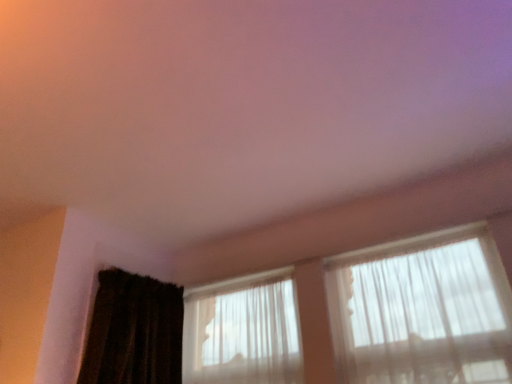
Question: From a real-world perspective, is translucent fabric at upper right, which ranks as the second window in left-to-right order, over translucent fabric window at center, the second window positioned from the right?

Choices:
 (A) yes
 (B) no

Answer: (B)

Question: Is translucent fabric at upper right, positioned as the 1th window in right-to-left order, not close to translucent fabric window at center, the second window positioned from the right?

Choices:
 (A) yes
 (B) no

Answer: (B)

Question: Considering the relative sizes of translucent fabric at upper right, which ranks as the second window in left-to-right order, and translucent fabric window at center, which is the first window from left to right, in the image provided, is translucent fabric at upper right, which ranks as the second window in left-to-right order, smaller than translucent fabric window at center, which is the first window from left to right,?

Choices:
 (A) no
 (B) yes

Answer: (A)

Question: Is translucent fabric at upper right, positioned as the 1th window in right-to-left order, surrounding translucent fabric window at center, which is the first window from left to right?

Choices:
 (A) no
 (B) yes

Answer: (A)

Question: Is translucent fabric at upper right, which ranks as the second window in left-to-right order, next to translucent fabric window at center, which is the first window from left to right?

Choices:
 (A) no
 (B) yes

Answer: (A)

Question: Is translucent fabric at upper right, positioned as the 1th window in right-to-left order, looking in the opposite direction of translucent fabric window at center, which is the first window from left to right?

Choices:
 (A) no
 (B) yes

Answer: (A)

Question: Is translucent fabric at upper right, positioned as the 1th window in right-to-left order, outside of dark brown textured curtain at lower left?

Choices:
 (A) no
 (B) yes

Answer: (B)

Question: From a real-world perspective, is translucent fabric at upper right, which ranks as the second window in left-to-right order, over dark brown textured curtain at lower left?

Choices:
 (A) no
 (B) yes

Answer: (A)

Question: From a real-world perspective, is translucent fabric at upper right, which ranks as the second window in left-to-right order, below dark brown textured curtain at lower left?

Choices:
 (A) no
 (B) yes

Answer: (B)

Question: Considering the relative sizes of translucent fabric at upper right, positioned as the 1th window in right-to-left order, and dark brown textured curtain at lower left in the image provided, is translucent fabric at upper right, positioned as the 1th window in right-to-left order, thinner than dark brown textured curtain at lower left?

Choices:
 (A) yes
 (B) no

Answer: (A)

Question: Is dark brown textured curtain at lower left a part of translucent fabric at upper right, which ranks as the second window in left-to-right order?

Choices:
 (A) no
 (B) yes

Answer: (A)

Question: Is translucent fabric at upper right, which ranks as the second window in left-to-right order, bigger than dark brown textured curtain at lower left?

Choices:
 (A) yes
 (B) no

Answer: (B)

Question: Is dark brown textured curtain at lower left at the back of translucent fabric window at center, the second window positioned from the right?

Choices:
 (A) yes
 (B) no

Answer: (B)